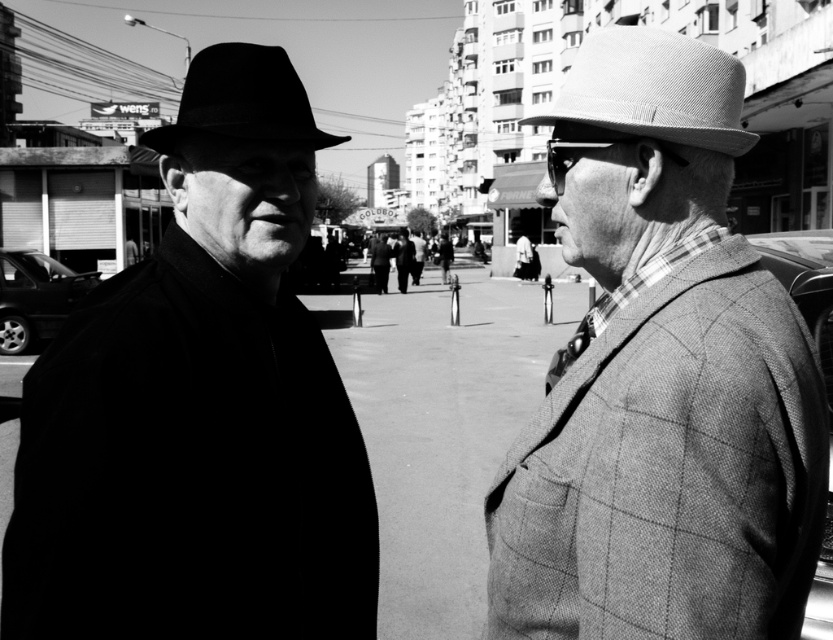
Question: Is matte black hat at left wider than matte black fedora at upper left?

Choices:
 (A) no
 (B) yes

Answer: (A)

Question: Does matte black hat at left have a lesser width compared to textured gray cowboy hat at upper right?

Choices:
 (A) yes
 (B) no

Answer: (A)

Question: Does plaid wool jacket at right lie behind matte black fedora at upper left?

Choices:
 (A) yes
 (B) no

Answer: (B)

Question: Among these points, which one is nearest to the camera?

Choices:
 (A) (277, 582)
 (B) (257, 56)

Answer: (A)

Question: Which point is closer to the camera?

Choices:
 (A) (23, 454)
 (B) (337, 144)
 (C) (706, 141)
 (D) (722, 252)

Answer: (D)

Question: Which object appears farthest from the camera in this image?

Choices:
 (A) matte black fedora at upper left
 (B) matte black hat at left

Answer: (A)